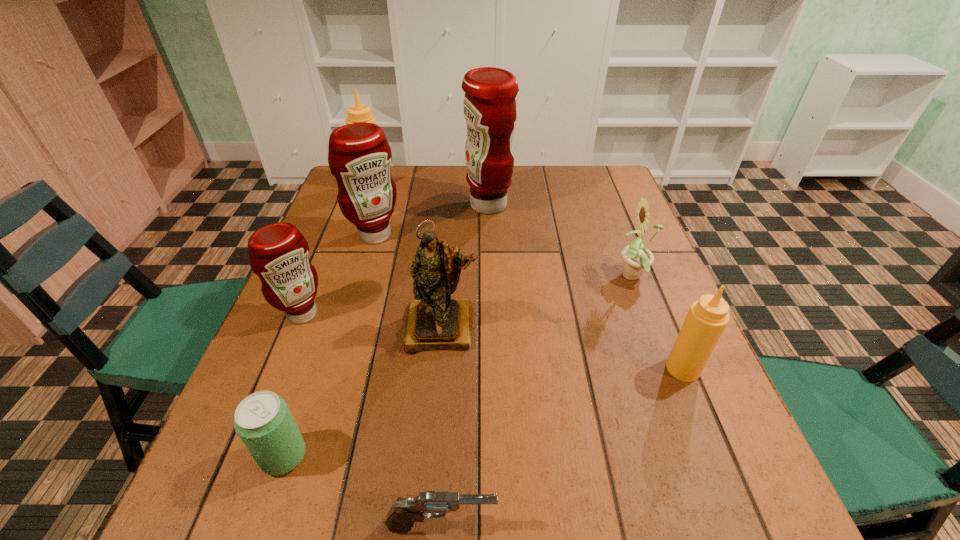
This screenshot has width=960, height=540. Find the location of `the tallest condiment`. the tallest condiment is located at coordinates (490, 111).

You are a GUI agent. You are given a task and a screenshot of the screen. Output one action in this format:
    pyautogui.click(x=<x>, y=<y>)
    Task: Click on the biggest red condiment
    The image size is (960, 540).
    Given the screenshot: What is the action you would take?
    pyautogui.click(x=490, y=111)

Where is `the left tan condiment`? The width and height of the screenshot is (960, 540). the left tan condiment is located at coordinates (359, 113).

At what (x,y) coordinates should I click in order to perform the action: click on the farther tan condiment. Please return your answer as a coordinate pair (x, y). The width and height of the screenshot is (960, 540). Looking at the image, I should click on click(x=359, y=113).

Locate an element on the screen. This screenshot has height=540, width=960. the second smallest red condiment is located at coordinates coord(359,156).

Image resolution: width=960 pixels, height=540 pixels. What are the coordinates of `gold figurine` in the screenshot? It's located at (434, 321).

Identify the location of the rightmost condiment. (707, 318).

Locate an element on the screen. This screenshot has width=960, height=540. the nearer tan condiment is located at coordinates (707, 318).

The width and height of the screenshot is (960, 540). In order to click on the smallest red condiment in this screenshot , I will do `click(278, 253)`.

The image size is (960, 540). What are the coordinates of `the nearest red condiment` in the screenshot? It's located at (278, 253).